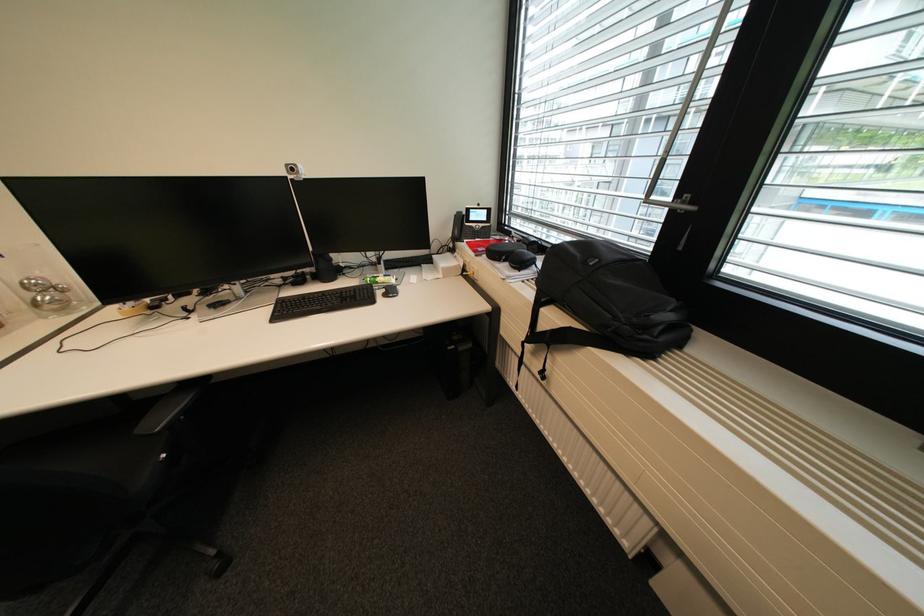
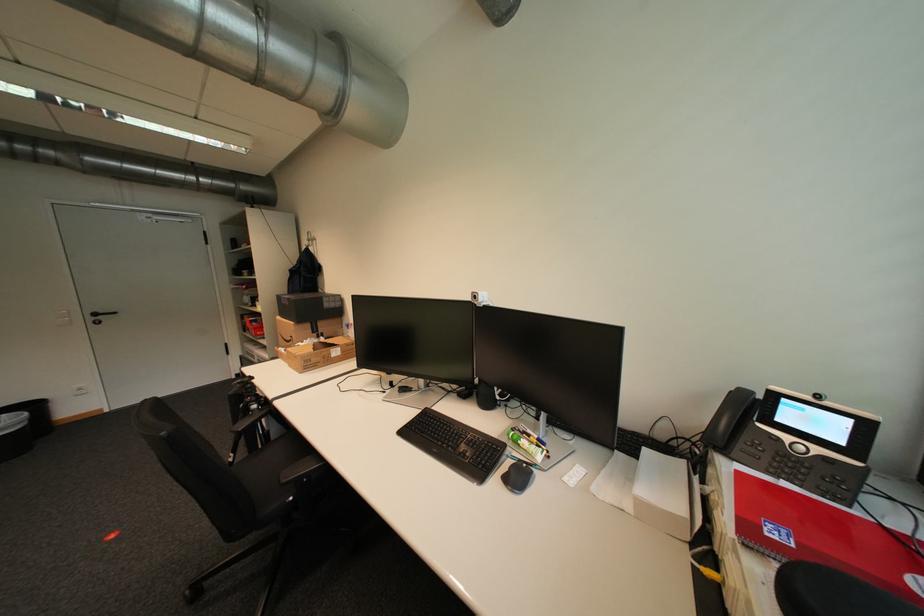
Question: The camera is either moving clockwise (left) or counter-clockwise (right) around the object. The first image is from the beginning of the video and the second image is from the end. Is the camera moving left or right when shooting the video?

Choices:
 (A) Left
 (B) Right

Answer: (B)